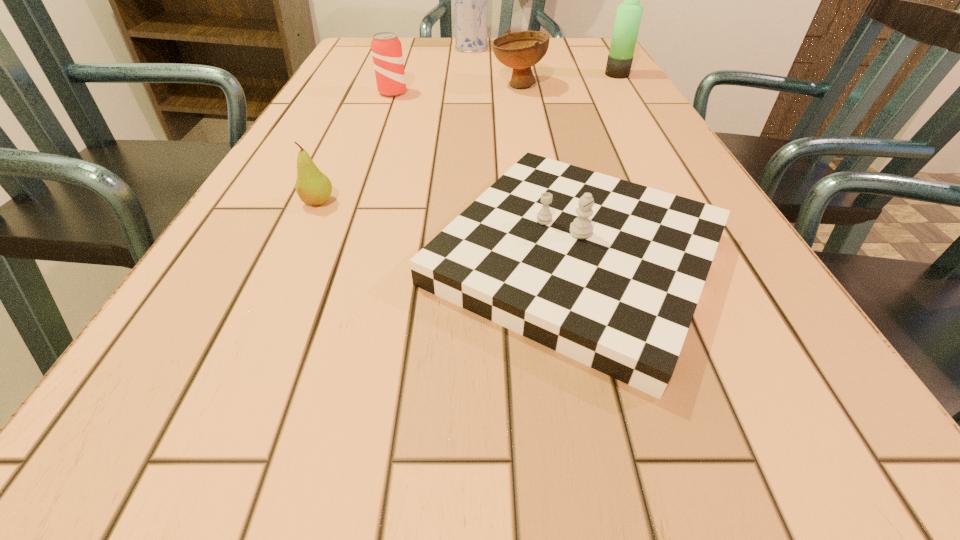
Image resolution: width=960 pixels, height=540 pixels. I want to click on vacant space located on the back of the pear, so click(366, 99).

Where is `free point located 0.330m on the back of the checkerboard`? This screenshot has height=540, width=960. free point located 0.330m on the back of the checkerboard is located at coordinates (539, 101).

At what (x,y) coordinates should I click in order to perform the action: click on object at the far edge. Please return your answer as a coordinate pair (x, y). Looking at the image, I should click on (470, 0).

Where is `beer can located in the left edge section of the desktop`? beer can located in the left edge section of the desktop is located at coordinates (386, 48).

Locate an element on the screen. This screenshot has width=960, height=540. pear that is at the left edge is located at coordinates (313, 187).

Find the location of a particular element. thermos bottle that is at the right edge is located at coordinates (629, 13).

This screenshot has height=540, width=960. I want to click on checkerboard positioned at the right edge, so click(608, 272).

I want to click on vacant point at the left edge, so click(x=271, y=330).

The width and height of the screenshot is (960, 540). What are the coordinates of `vacant space at the right edge of the desktop` in the screenshot? It's located at (781, 353).

Where is `vacant space at the far left corner of the desktop`? This screenshot has height=540, width=960. vacant space at the far left corner of the desktop is located at coordinates (357, 46).